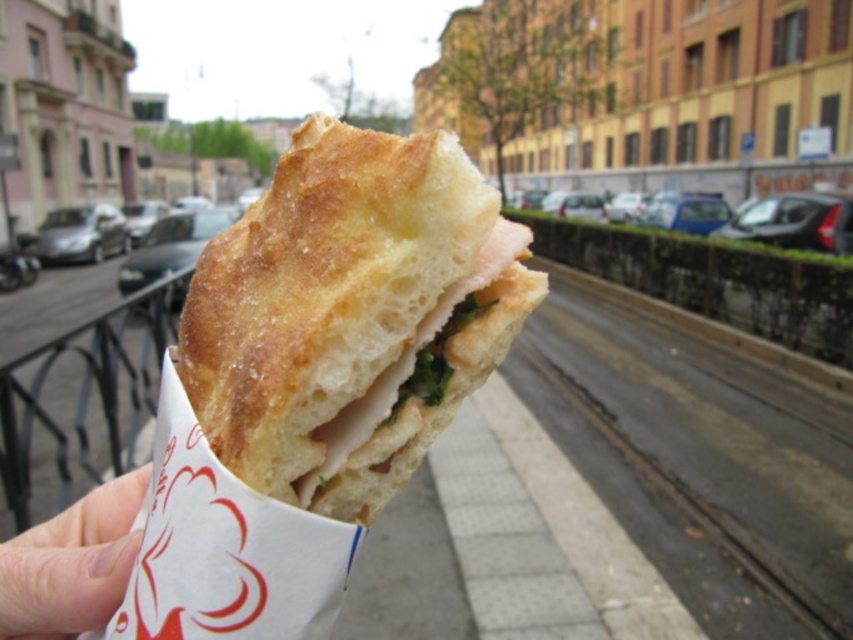
Can you confirm if golden brown crusty bread at center is taller than pale skin at lower left?

Yes, golden brown crusty bread at center is taller than pale skin at lower left.

This screenshot has height=640, width=853. Identify the location of golden brown crusty bread at center. (351, 316).

Between dark gray concrete train track at lower center and pale skin at lower left, which one appears on the right side from the viewer's perspective?

dark gray concrete train track at lower center

Where is `dark gray concrete train track at lower center`? The width and height of the screenshot is (853, 640). dark gray concrete train track at lower center is located at coordinates (671, 516).

Who is shorter, golden brown crusty bread at center or dark gray concrete train track at lower center?

golden brown crusty bread at center is shorter.

Does point (310, 372) come in front of point (515, 364)?

That is True.

Locate an element on the screen. The image size is (853, 640). golden brown crusty bread at center is located at coordinates [x=351, y=316].